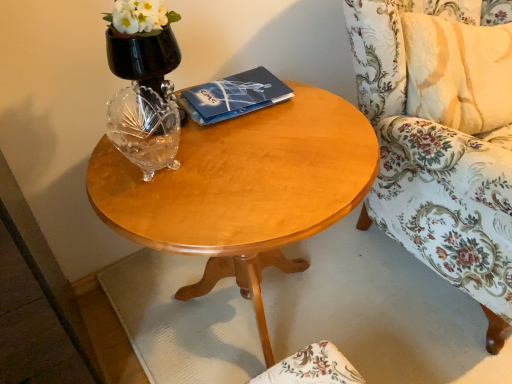
Locate an element on the screen. Image resolution: width=512 pixels, height=384 pixels. free location in front of black glass vase at upper left is located at coordinates (187, 163).